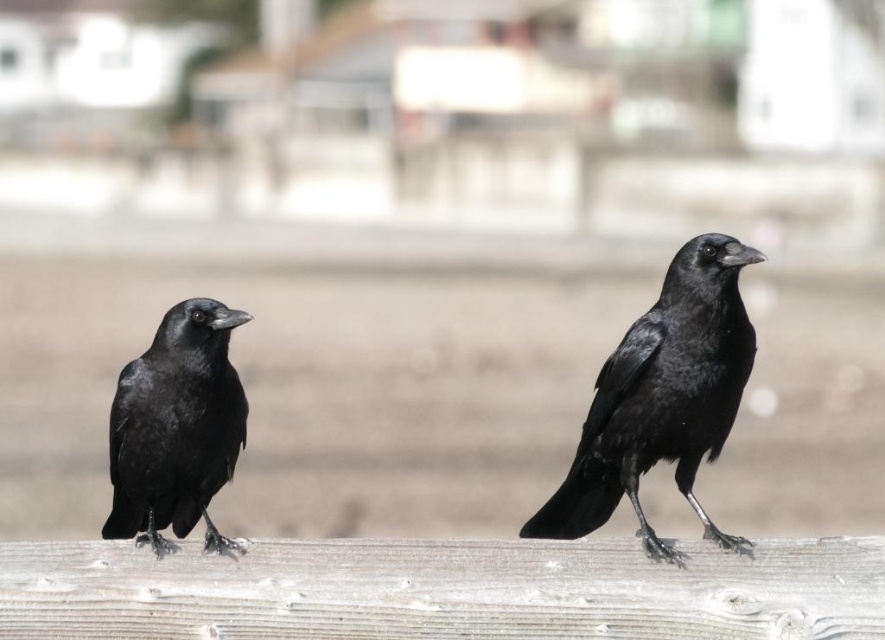
Locate an element on the screen. matte black raven at center is located at coordinates (662, 397).

Does matte black raven at center appear on the right side of matte black raven at left?

Indeed, matte black raven at center is positioned on the right side of matte black raven at left.

Is point (655, 458) positioned behind point (205, 516)?

Yes, it is.

Image resolution: width=885 pixels, height=640 pixels. In order to click on matte black raven at center in this screenshot , I will do `click(662, 397)`.